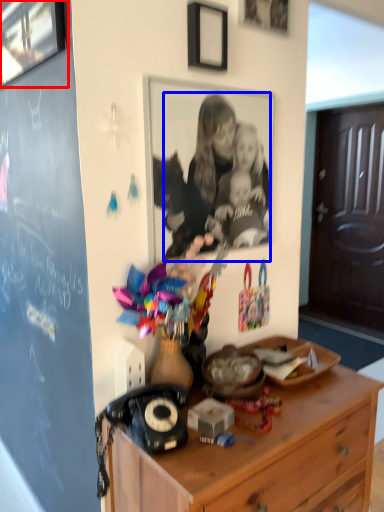
Question: Which object is further to the camera taking this photo, picture frame (highlighted by a red box) or person (highlighted by a blue box)?

Choices:
 (A) picture frame
 (B) person

Answer: (B)